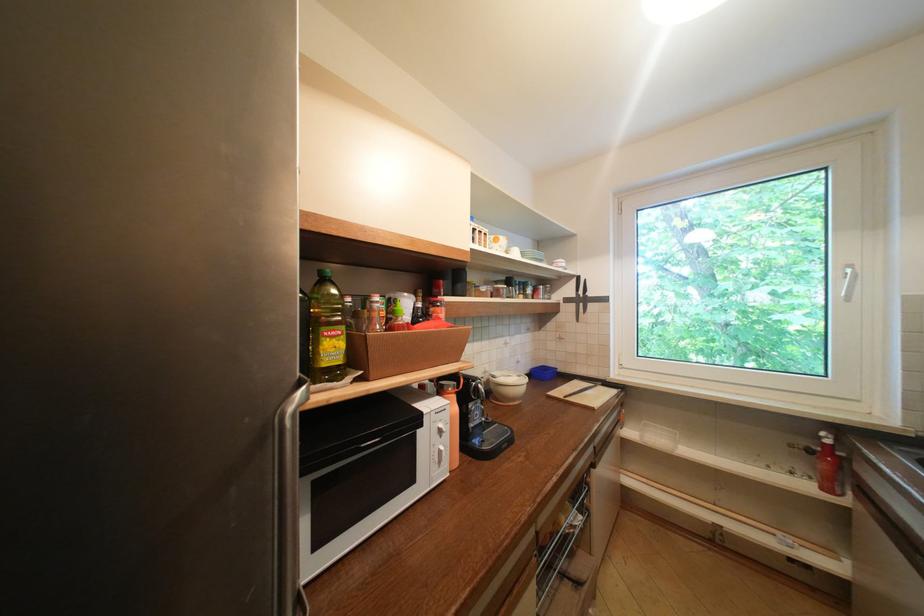
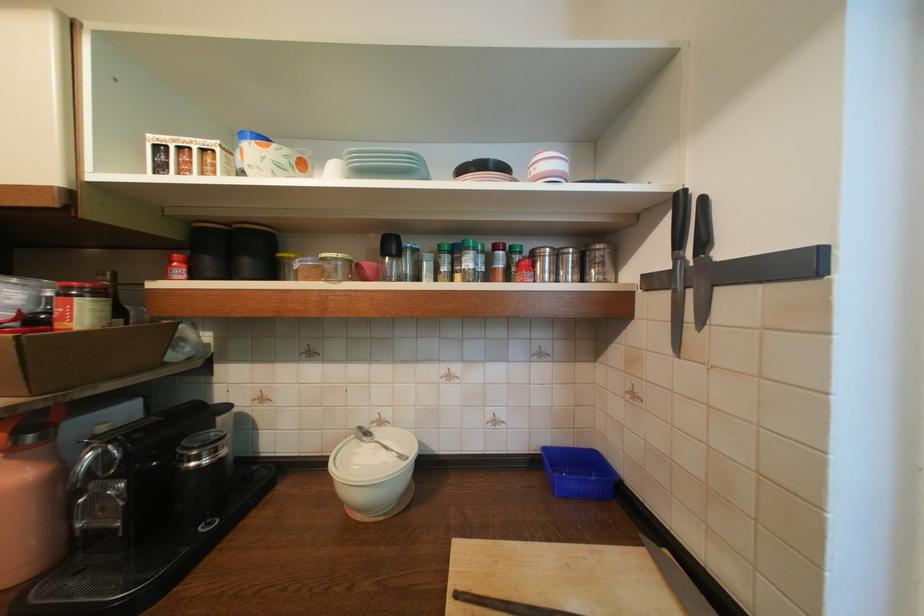
Locate, in the second image, the point that corresponds to (x=448, y=296) in the first image.

(174, 278)